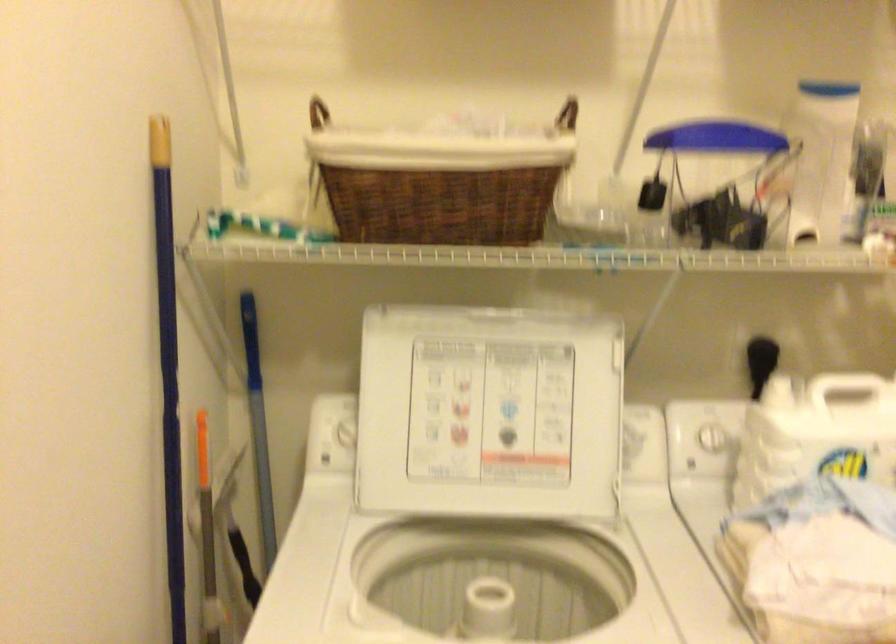
I want to click on white washer lid, so click(x=488, y=413).